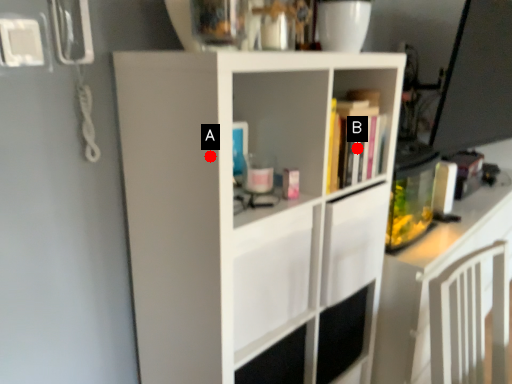
Question: Two points are circled on the image, labeled by A and B beside each circle. Which point appears farthest from the camera in this image?

Choices:
 (A) A is further
 (B) B is further

Answer: (B)